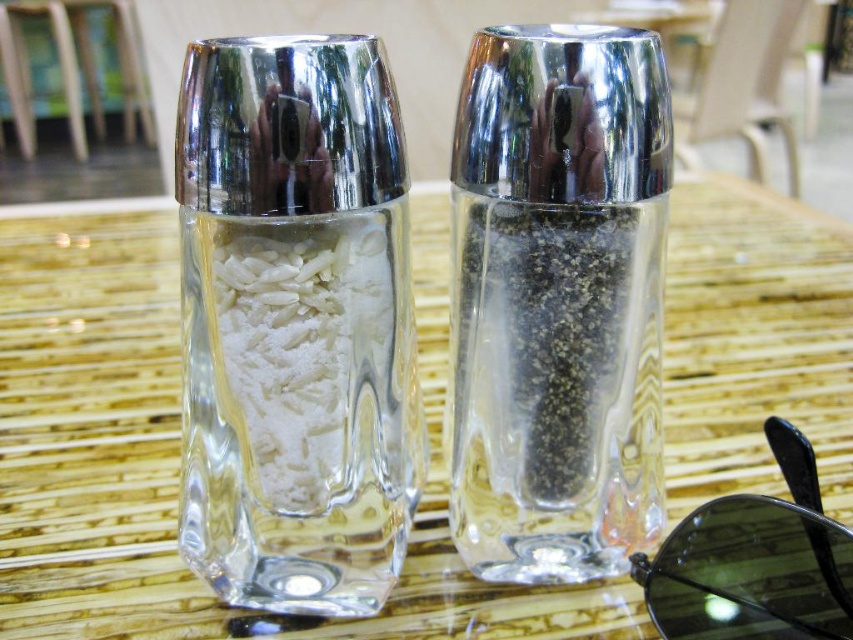
Question: Can you confirm if clear glass table at center is smaller than black plastic sunglasses at lower right?

Choices:
 (A) yes
 (B) no

Answer: (B)

Question: Which object is the closest to the clear glass salt shaker at center?

Choices:
 (A) clear glass pepper grinder at right
 (B) white matte rice at center

Answer: (B)

Question: Which object is closer to the camera taking this photo?

Choices:
 (A) clear glass salt shaker at center
 (B) black plastic sunglasses at lower right
 (C) clear glass pepper grinder at right
 (D) white matte rice at center

Answer: (B)

Question: Can you confirm if clear glass pepper grinder at right is bigger than white matte rice at center?

Choices:
 (A) yes
 (B) no

Answer: (A)

Question: Is clear glass salt shaker at center further to camera compared to black plastic sunglasses at lower right?

Choices:
 (A) yes
 (B) no

Answer: (A)

Question: Which object appears closest to the camera in this image?

Choices:
 (A) clear glass table at center
 (B) clear glass pepper grinder at right
 (C) white matte rice at center
 (D) black plastic sunglasses at lower right

Answer: (D)